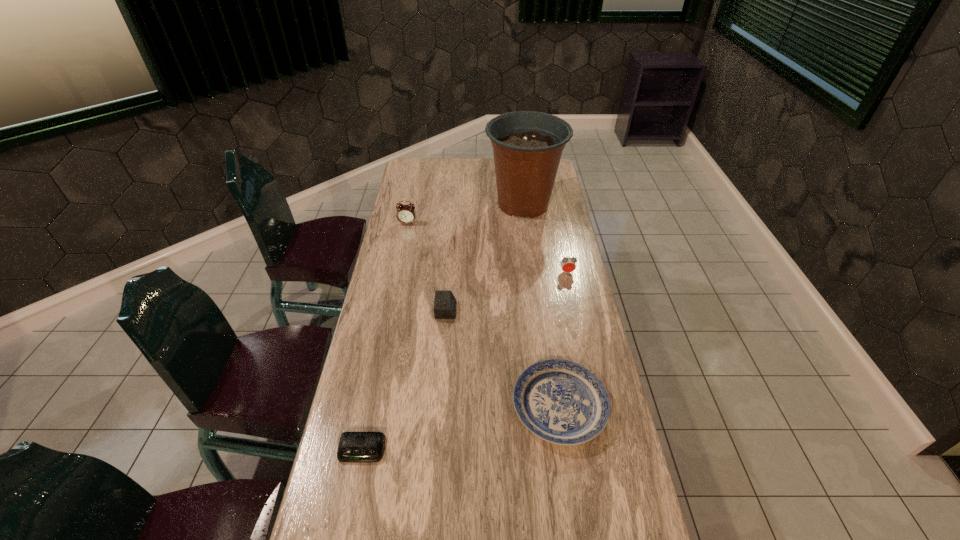
Find the location of `the tallest object`. the tallest object is located at coordinates (527, 145).

Locate an element on the screen. The height and width of the screenshot is (540, 960). the farthest alarm clock is located at coordinates (406, 214).

At what (x,y) coordinates should I click in order to perform the action: click on the tallest alarm clock. Please return your answer as a coordinate pair (x, y). Image resolution: width=960 pixels, height=540 pixels. Looking at the image, I should click on (406, 214).

Find the location of a particular element. The image size is (960, 540). the third farthest object is located at coordinates point(568,265).

Locate an element on the screen. The height and width of the screenshot is (540, 960). the rightmost alarm clock is located at coordinates 568,265.

Where is `the third shortest object`? This screenshot has width=960, height=540. the third shortest object is located at coordinates [445, 303].

Image resolution: width=960 pixels, height=540 pixels. In order to click on the second nearest alarm clock in this screenshot , I will do `click(445, 303)`.

Identify the location of the fifth tallest object. (560, 401).

Locate an element on the screen. This screenshot has width=960, height=540. the shortest object is located at coordinates (355, 447).

Locate an element on the screen. the shortest alarm clock is located at coordinates (355, 447).